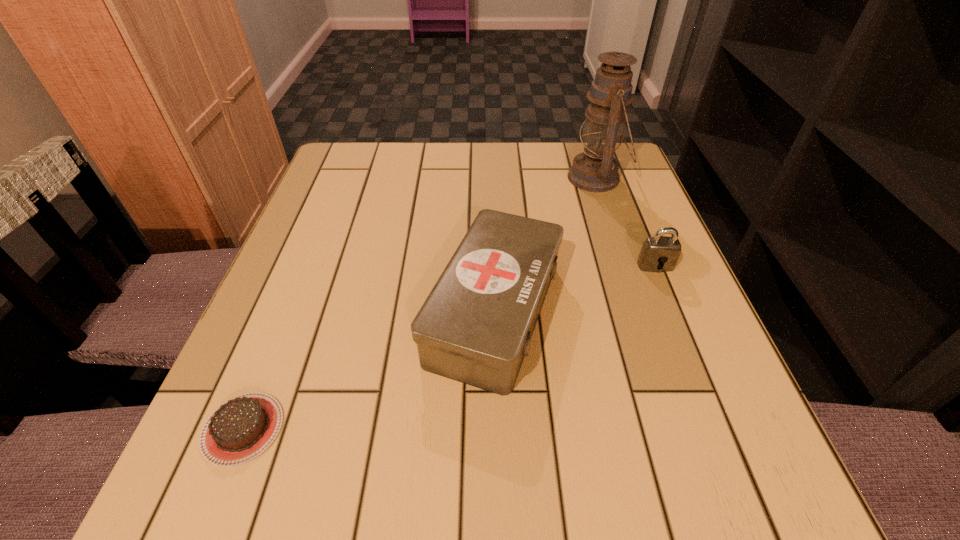
The height and width of the screenshot is (540, 960). I want to click on free space at the right edge of the desktop, so click(639, 223).

You are a GUI agent. You are given a task and a screenshot of the screen. Output one action in this format:
    pyautogui.click(x=<x>, y=<y>)
    Task: Click on the vacant space at the far left corner of the desktop
    This screenshot has height=540, width=960.
    Given the screenshot: What is the action you would take?
    coord(354,182)

I want to click on free spot at the near right corner of the desktop, so click(708, 503).

At what (x,y) coordinates should I click in order to perform the action: click on free point between the chocolate cake and the second object from left to right. Please return your answer as a coordinate pair (x, y). Looking at the image, I should click on (369, 370).

The image size is (960, 540). In order to click on vacant area between the first-aid kit and the padlock in this screenshot , I will do `click(575, 288)`.

The image size is (960, 540). What are the coordinates of `free space between the tallest object and the padlock` in the screenshot? It's located at (626, 222).

Locate an element on the screen. The width and height of the screenshot is (960, 540). free space that is in between the leftmost object and the second object from left to right is located at coordinates (369, 370).

Where is `vacant area that lies between the second object from left to right and the padlock`? This screenshot has width=960, height=540. vacant area that lies between the second object from left to right and the padlock is located at coordinates (575, 288).

At what (x,y) coordinates should I click in order to perform the action: click on free space between the chocolate cake and the tallest object. Please return your answer as a coordinate pair (x, y). The width and height of the screenshot is (960, 540). Looking at the image, I should click on (420, 303).

Point out which object is positioned as the nearest to the second object from left to right. Please provide its 2D coordinates. Your answer should be formatted as a tuple, i.e. [(x, y)], where the tuple contains the x and y coordinates of a point satisfying the conditions above.

[(660, 253)]